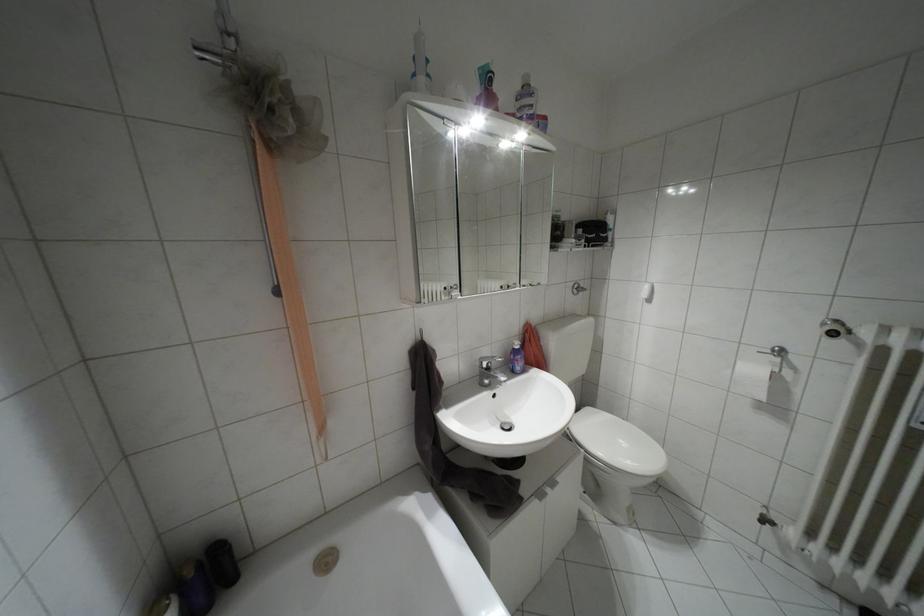
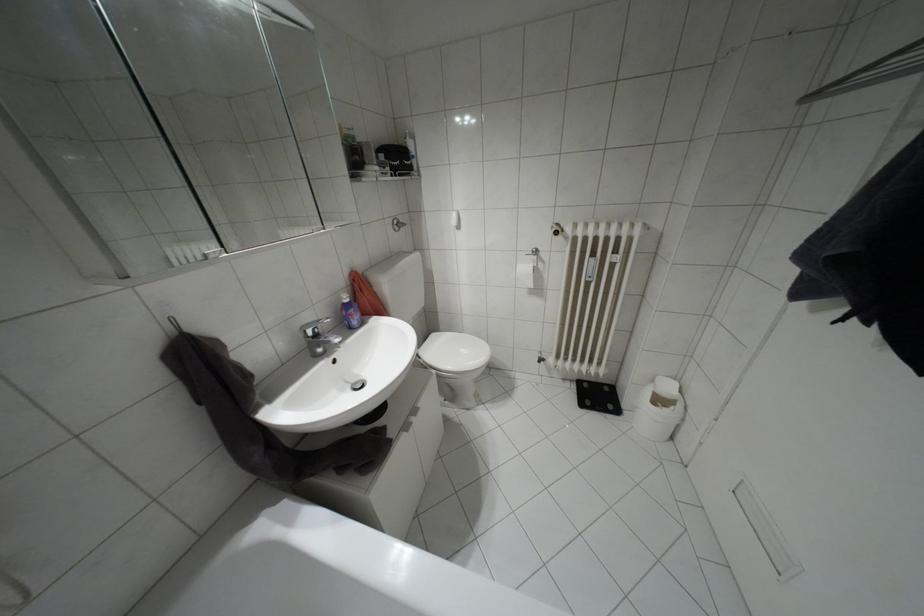
Where in the second image is the point corresponding to (x=484, y=358) from the first image?

(307, 323)